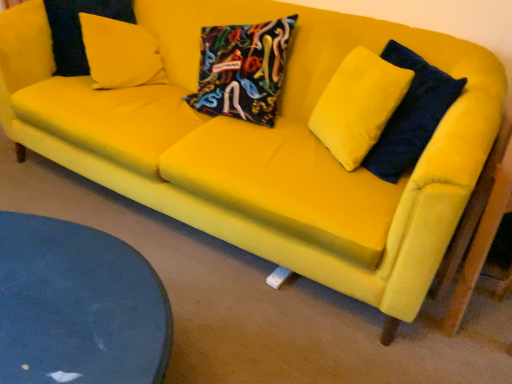
The image size is (512, 384). I want to click on wooden side table at right, so pyautogui.click(x=478, y=228).

This screenshot has height=384, width=512. Describe the element at coordinates (478, 228) in the screenshot. I see `wooden side table at right` at that location.

Find the location of a particular element. The height and width of the screenshot is (384, 512). wooden side table at right is located at coordinates [x=478, y=228].